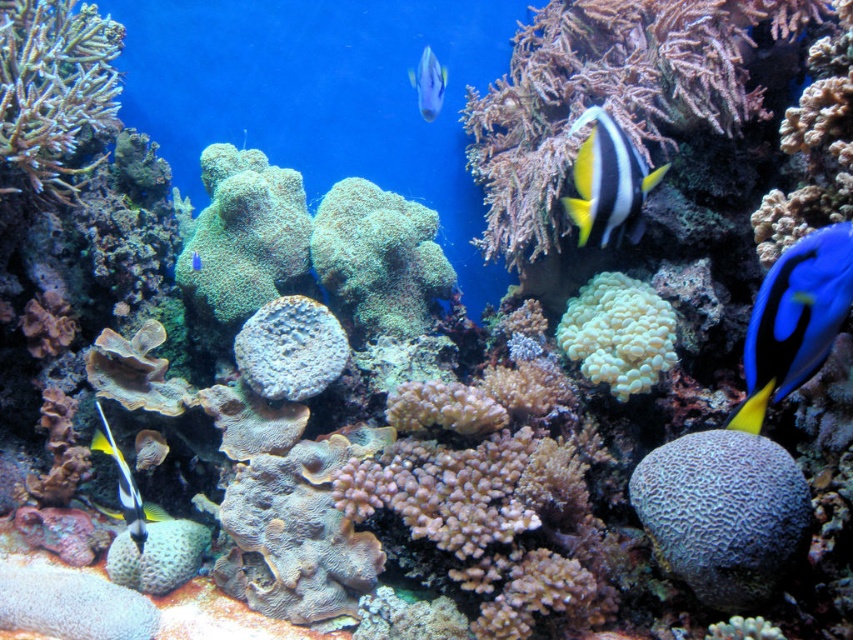
Question: Which of the following is the closest to the observer?

Choices:
 (A) shiny silver fish at upper center
 (B) blue glossy fish at right

Answer: (B)

Question: Is gray coral at center positioned at the back of shiny silver fish at upper center?

Choices:
 (A) no
 (B) yes

Answer: (A)

Question: Which point is farther from the camera taking this photo?

Choices:
 (A) (799, 378)
 (B) (431, 77)

Answer: (B)

Question: Where is black and white striped fish at lower left located in relation to blue glossy fish at center in the image?

Choices:
 (A) right
 (B) left

Answer: (A)

Question: Can you confirm if blue glossy fish at right is wider than shiny silver fish at upper center?

Choices:
 (A) no
 (B) yes

Answer: (A)

Question: Which point appears closest to the camera in this image?

Choices:
 (A) (138, 522)
 (B) (619, 380)
 (C) (753, 428)

Answer: (C)